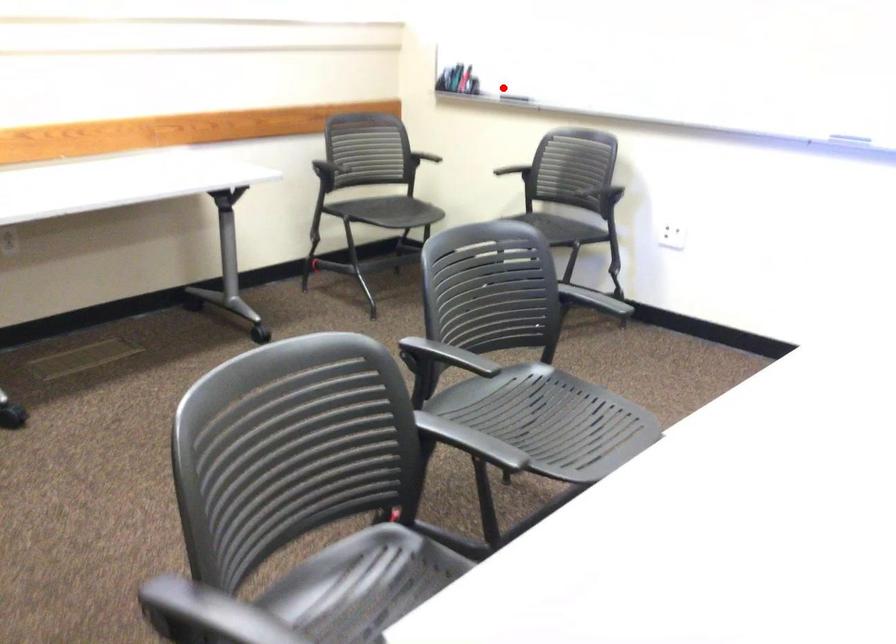
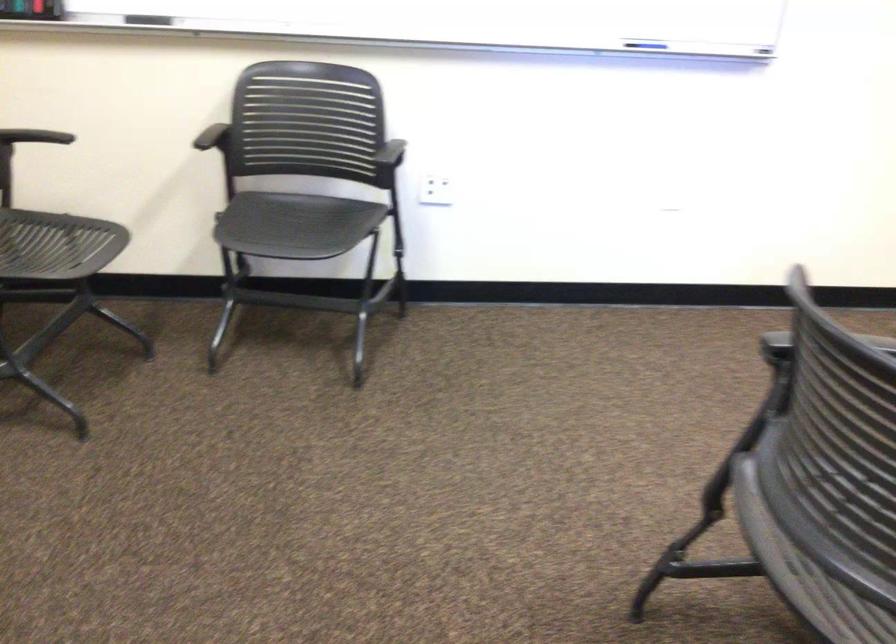
Question: I am providing you with two images of the same scene from different viewpoints. A red point is shown in image1. For the corresponding object point in image2, is it positioned nearer or farther from the camera?

Choices:
 (A) Nearer
 (B) Farther

Answer: (A)